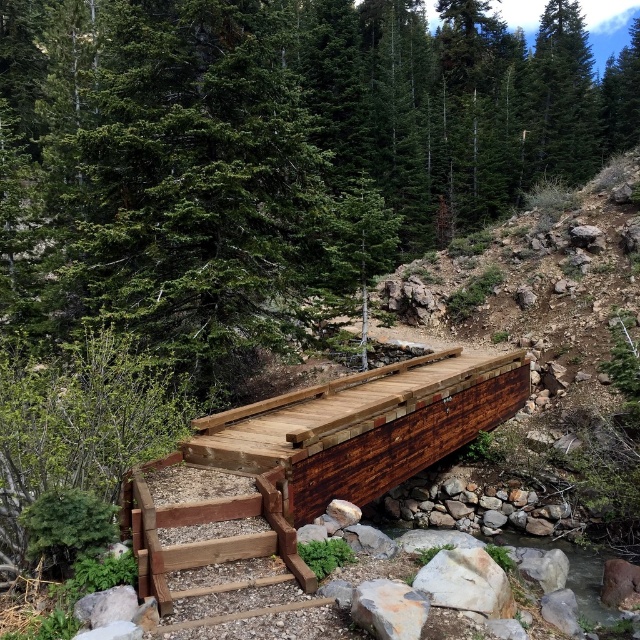
Based on the photo, you are planning to walk across the rustic wood bridge at center while carrying a large backpack. There is a green matte tree at center nearby. Considering the width of the bridge and the tree, will you have enough space to walk safely without hitting the tree?

The green matte tree at center is wider than the rustic wood bridge at center, so there might not be enough space to walk safely without potentially hitting the tree. Proceed with caution.

You are standing on the rustic wood bridge at center and want to take a photo of the green matte tree at center. In which direction should you point your camera to capture the tree?

You should point your camera to the right because the green matte tree at center is to the right of the rustic wood bridge at center.